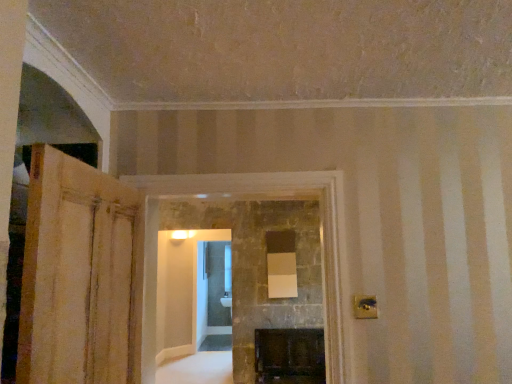
Question: Does dark stone fireplace at center have a lesser width compared to wooden door at left?

Choices:
 (A) no
 (B) yes

Answer: (A)

Question: Is wooden door at left surrounded by dark stone fireplace at center?

Choices:
 (A) no
 (B) yes

Answer: (A)

Question: Can you confirm if dark stone fireplace at center is taller than wooden door at left?

Choices:
 (A) yes
 (B) no

Answer: (A)

Question: Is dark stone fireplace at center at the left side of wooden door at left?

Choices:
 (A) no
 (B) yes

Answer: (A)

Question: From the image's perspective, does dark stone fireplace at center appear lower than wooden door at left?

Choices:
 (A) yes
 (B) no

Answer: (A)

Question: Does dark stone fireplace at center have a smaller size compared to wooden door at left?

Choices:
 (A) yes
 (B) no

Answer: (B)

Question: Is wooden door at left further to the viewer compared to dark stone fireplace at center?

Choices:
 (A) yes
 (B) no

Answer: (B)

Question: Can you confirm if wooden door at left is wider than dark stone fireplace at center?

Choices:
 (A) yes
 (B) no

Answer: (B)

Question: From a real-world perspective, does wooden door at left sit lower than dark stone fireplace at center?

Choices:
 (A) no
 (B) yes

Answer: (B)

Question: Is wooden door at left at the right side of dark stone fireplace at center?

Choices:
 (A) yes
 (B) no

Answer: (B)

Question: Can you confirm if wooden door at left is smaller than dark stone fireplace at center?

Choices:
 (A) yes
 (B) no

Answer: (A)

Question: Is wooden door at left at the left side of dark stone fireplace at center?

Choices:
 (A) no
 (B) yes

Answer: (B)

Question: In the image, is wooden door at left on the left side or the right side of dark stone fireplace at center?

Choices:
 (A) left
 (B) right

Answer: (A)